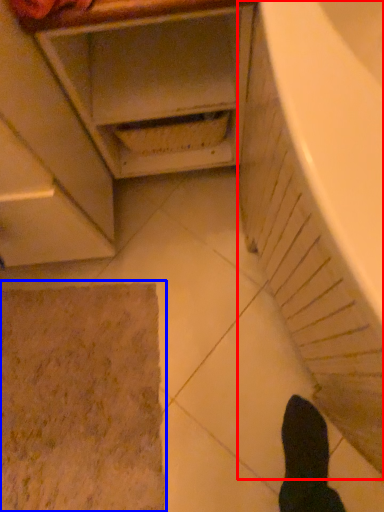
Question: Which object appears closest to the camera in this image, bath (highlighted by a red box) or bath mat (highlighted by a blue box)?

Choices:
 (A) bath
 (B) bath mat

Answer: (A)